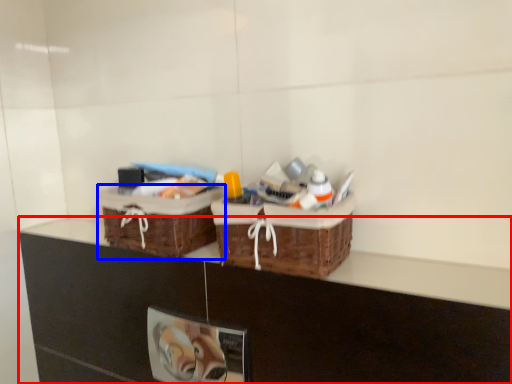
Question: Which object appears closest to the camera in this image, counter (highlighted by a red box) or picnic basket (highlighted by a blue box)?

Choices:
 (A) counter
 (B) picnic basket

Answer: (A)